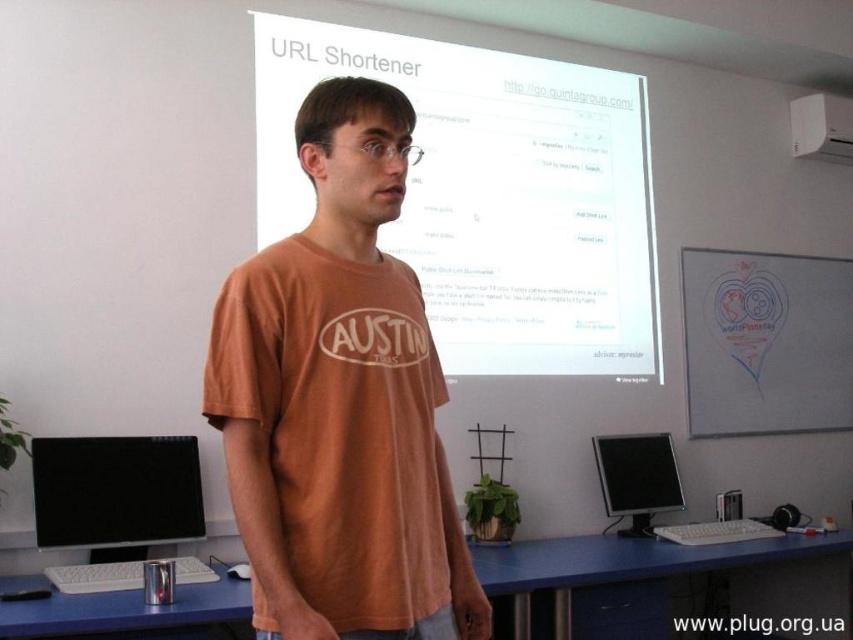
You are a student in the classroom and you want to take a photo of the white glossy projector screen at upper center. Since the screen is at point 0.305, 0.577, where exactly should you position your camera to capture it properly?

The white glossy projector screen at upper center is positioned at point (491, 195), so you should aim your camera towards that coordinate to capture it properly.